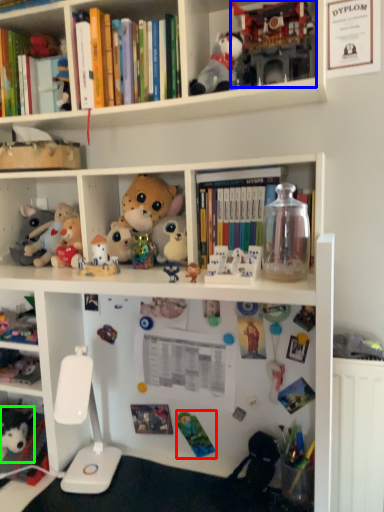
Question: Estimate the real-world distances between objects in this image. Which object is closer to toy (highlighted by a red box), toy (highlighted by a blue box) or toy (highlighted by a green box)?

Choices:
 (A) toy
 (B) toy

Answer: (B)